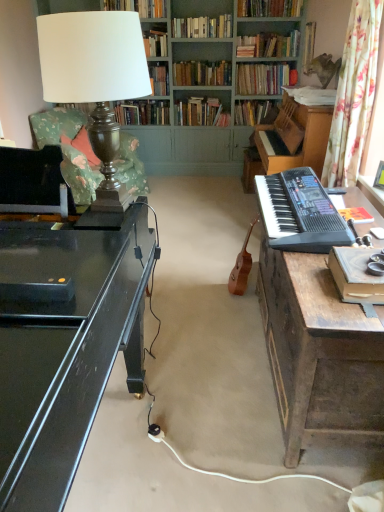
The image size is (384, 512). Find the location of `hardcover book at upper center, positioned as the 5th book in back-to-front order`. hardcover book at upper center, positioned as the 5th book in back-to-front order is located at coordinates (159, 79).

Where is `hardcover books at center, the 11th book in the front-to-back sequence`? hardcover books at center, the 11th book in the front-to-back sequence is located at coordinates (200, 112).

The image size is (384, 512). Find the location of `wooden acoustic guitar at center`. wooden acoustic guitar at center is located at coordinates (242, 266).

Measure the distance between point (280, 234) and camera.

6.20 feet.

Locate an element on the screen. This screenshot has width=384, height=512. hardcover book at upper center, the 5th book in the front-to-back sequence is located at coordinates (202, 27).

What do you see at coordinates (202, 73) in the screenshot? I see `hardcover books at center, arranged as the 9th book when viewed from the front` at bounding box center [202, 73].

You are a GUI agent. You are given a task and a screenshot of the screen. Output one action in this format:
    pyautogui.click(x=<x>, y=<y>)
    Task: Click on the hardcover book at upper center, positioned as the 5th book in back-to-front order
    This screenshot has height=512, width=384.
    Given the screenshot: What is the action you would take?
    pyautogui.click(x=159, y=79)

Is black plastic keyboard at right behind hardcover book at upper center, positioned as the 5th book in back-to-front order?

No, black plastic keyboard at right is closer to the camera.

Is black plastic keyboard at right far away from hardcover book at upper center, the eighth book viewed from the front?

Yes, black plastic keyboard at right and hardcover book at upper center, the eighth book viewed from the front, are quite far apart.

Is point (271, 227) farther from camera compared to point (155, 87)?

No, it is in front of (155, 87).

Considering the sizes of objects hardcover book at center, arranged as the first book when viewed from the back, and hardcover book at upper center, the 4th book viewed from the front, in the image provided, who is smaller, hardcover book at center, arranged as the first book when viewed from the back, or hardcover book at upper center, the 4th book viewed from the front,?

hardcover book at upper center, the 4th book viewed from the front.

From a real-world perspective, starting from the hardcover book at upper center, placed as the 9th book when sorted from back to front, which book is the 10th one below it? Please provide its 2D coordinates.

[(142, 113)]

Is hardcover book at center, arranged as the first book when viewed from the back, further to camera compared to hardcover book at upper center, the 4th book viewed from the front?

Yes, hardcover book at center, arranged as the first book when viewed from the back, is behind hardcover book at upper center, the 4th book viewed from the front.

Is hardcover book at center, which appears as the 12th book when viewed from the front, positioned far away from hardcover book at upper center, placed as the 9th book when sorted from back to front?

Yes, hardcover book at center, which appears as the 12th book when viewed from the front, and hardcover book at upper center, placed as the 9th book when sorted from back to front, are located far from each other.

This screenshot has width=384, height=512. I want to click on book that is the 5th one above the hardcover book at center, which is the tenth book from front to back (from a real-world perspective), so click(x=263, y=78).

Is hardcover book at center, the seventh book in the front-to-back sequence, closer to camera compared to hardcover book at center, which appears as the 3th book when viewed from the back?

Yes, it is in front of hardcover book at center, which appears as the 3th book when viewed from the back.

Is hardcover book at center, the seventh book in the front-to-back sequence, wider than hardcover book at center, which appears as the 3th book when viewed from the back?

No.

Is hardcover book at upper center, positioned as the 6th book in front-to-back order, inside the boundaries of wooden desk at right, or outside?

hardcover book at upper center, positioned as the 6th book in front-to-back order, exists outside the volume of wooden desk at right.

Which of these two, hardcover book at upper center, positioned as the 6th book in front-to-back order, or wooden desk at right, is bigger?

wooden desk at right.

What's the angular difference between hardcover book at upper center, positioned as the 6th book in front-to-back order, and wooden desk at right's facing directions?

The angular difference between hardcover book at upper center, positioned as the 6th book in front-to-back order, and wooden desk at right is 93.7 degrees.

From a real-world perspective, is hardcover book at upper center, which is counted as the seventh book, starting from the back, below wooden desk at right?

No, from a real-world perspective, hardcover book at upper center, which is counted as the seventh book, starting from the back, is not beneath wooden desk at right.

How much distance is there between hardcover book at center, which appears as the 12th book when viewed from the front, and hardcover book at upper center, placed as the 8th book when sorted from back to front?

They are 35.40 inches apart.

Is hardcover book at center, which appears as the 12th book when viewed from the front, far from hardcover book at upper center, the 5th book in the front-to-back sequence?

They are positioned close to each other.

Can you confirm if hardcover book at center, which appears as the 12th book when viewed from the front, is positioned to the right of hardcover book at upper center, placed as the 8th book when sorted from back to front?

No, hardcover book at center, which appears as the 12th book when viewed from the front, is not to the right of hardcover book at upper center, placed as the 8th book when sorted from back to front.

Is hardcover book at center, arranged as the first book when viewed from the back, inside or outside of hardcover book at upper center, placed as the 8th book when sorted from back to front?

hardcover book at center, arranged as the first book when viewed from the back, lies outside hardcover book at upper center, placed as the 8th book when sorted from back to front.

From a real-world perspective, starting from the floral fabric swivel chair at left, which book is the 9th one vertically above it? Please provide its 2D coordinates.

[(268, 45)]

Considering the sizes of objects hardcover book at upper center, which is counted as the seventh book, starting from the back, and floral fabric swivel chair at left in the image provided, who is bigger, hardcover book at upper center, which is counted as the seventh book, starting from the back, or floral fabric swivel chair at left?

floral fabric swivel chair at left.

Is hardcover book at upper center, which is counted as the seventh book, starting from the back, positioned in front of floral fabric swivel chair at left?

No, hardcover book at upper center, which is counted as the seventh book, starting from the back, is further to the viewer.

In the scene shown: From the image's perspective, which is below, hardcover book at upper center, which is counted as the seventh book, starting from the back, or floral fabric swivel chair at left?

From the image's view, floral fabric swivel chair at left is below.

From the image's perspective, is hardcover books at center, acting as the 4th book starting from the back, under green painted wood bookcase at upper center?

Incorrect, from the image's perspective, hardcover books at center, acting as the 4th book starting from the back, is higher than green painted wood bookcase at upper center.

Would you say hardcover books at center, arranged as the 9th book when viewed from the front, is inside or outside green painted wood bookcase at upper center?

The correct answer is: inside.

The height and width of the screenshot is (512, 384). What are the coordinates of `bookcase located on the left of hardcover books at center, acting as the 4th book starting from the back` in the screenshot? It's located at (205, 90).

The image size is (384, 512). What are the coordinates of `the 1st book positioned above the black plastic keyboard at right (from a real-world perspective)` in the screenshot? It's located at (159, 79).

The image size is (384, 512). I want to click on the 8th book above when counting from the hardcover book at center, which appears as the 12th book when viewed from the front (from the image's perspective), so click(x=138, y=7).

Estimate the real-world distances between objects in this image. Which object is further from wooden desk at right, hardcover book at upper center, the 4th book viewed from the front, or hardcover book at center, which is the tenth book from front to back?

hardcover book at center, which is the tenth book from front to back, is positioned further to the anchor wooden desk at right.

Considering their positions, is green painted wood bookcase at upper center positioned further to hardcover book at upper center, placed as the 8th book when sorted from back to front, than hardcover book at upper right, the 11th book when ordered from back to front?

hardcover book at upper right, the 11th book when ordered from back to front, lies further to hardcover book at upper center, placed as the 8th book when sorted from back to front, than the other object.

Looking at the image, which one is located closer to wooden acoustic guitar at center, wooden desk at right or hardcover book at upper center, placed as the 9th book when sorted from back to front?

Based on the image, wooden desk at right appears to be nearer to wooden acoustic guitar at center.

From the picture: Considering their positions, is hardcover book at center, arranged as the first book when viewed from the back, positioned closer to hardcover book at upper center, the eighth book viewed from the front, than hardcover book at center, which is the tenth book from front to back?

Among the two, hardcover book at center, arranged as the first book when viewed from the back, is located nearer to hardcover book at upper center, the eighth book viewed from the front.

Which object lies further to the anchor point hardcover books at center, acting as the 4th book starting from the back, floral fabric curtain at right or wooden desk at right?

wooden desk at right is positioned further to the anchor hardcover books at center, acting as the 4th book starting from the back.

Estimate the real-world distances between objects in this image. Which object is further from hardcover book at upper center, positioned as the 6th book in front-to-back order, hardcover books at center, acting as the 4th book starting from the back, or wooden acoustic guitar at center?

Among the two, wooden acoustic guitar at center is located further to hardcover book at upper center, positioned as the 6th book in front-to-back order.

Looking at the image, which one is located closer to black plastic keyboard at right, hardcover book at upper center, marked as the 10th book in a back-to-front arrangement, or wooden desk at right?

Among the two, wooden desk at right is located nearer to black plastic keyboard at right.

Considering their positions, is floral fabric curtain at right positioned further to hardcover book at center, which appears as the 3th book when viewed from the back, than hardcover book at upper center, marked as the 10th book in a back-to-front arrangement?

floral fabric curtain at right is further to hardcover book at center, which appears as the 3th book when viewed from the back.

Identify the location of bookcase located between hardcover book at upper right, acting as the second book starting from the front, and hardcover book at upper center, the 5th book in the front-to-back sequence, in the depth direction. (205, 90).

At what (x,y) coordinates should I click in order to perform the action: click on curtain between wooden desk at right and hardcover books at center, the second book in the back-to-front sequence, in the front-back direction. Please return your answer as a coordinate pair (x, y). This screenshot has width=384, height=512. Looking at the image, I should click on (354, 95).

Locate an element on the screen. bookcase between wooden acoustic guitar at center and hardcover book at center, which is the 6th book from back to front, in the front-back direction is located at coordinates (205, 90).

Identify the location of swivel chair between black glossy desk at left and hardcover book at upper center, the 4th book viewed from the front, along the z-axis. (68, 150).